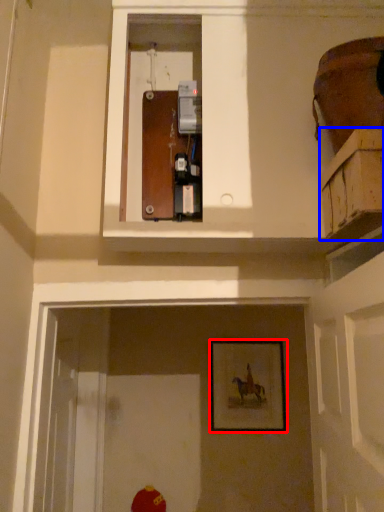
Question: Which point is closer to the camera, picture frame (highlighted by a red box) or cabinetry (highlighted by a blue box)?

Choices:
 (A) picture frame
 (B) cabinetry

Answer: (B)